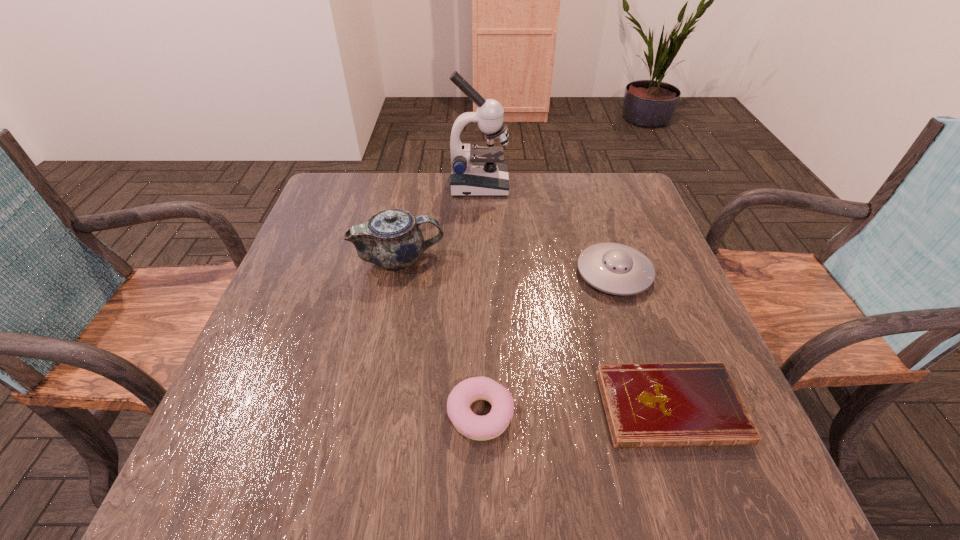
In the image, there is a desktop. Find the location of `free region at the left edge`. free region at the left edge is located at coordinates (315, 301).

Find the location of a particular element. vacant space at the right edge of the desktop is located at coordinates (656, 322).

You are a GUI agent. You are given a task and a screenshot of the screen. Output one action in this format:
    pyautogui.click(x=<x>, y=<y>)
    Task: Click on the free space at the far right corner of the desktop
    
    Given the screenshot: What is the action you would take?
    pyautogui.click(x=594, y=195)

Where is `vacant space that's between the shortest object and the chinaware`? This screenshot has width=960, height=540. vacant space that's between the shortest object and the chinaware is located at coordinates (535, 333).

Identify the location of free spot between the notebook and the second tallest object. The width and height of the screenshot is (960, 540). (535, 333).

You are a GUI agent. You are given a task and a screenshot of the screen. Output one action in this format:
    pyautogui.click(x=<x>, y=<y>)
    Task: Click on the vacant space in between the chinaware and the fourth tallest object
    The height and width of the screenshot is (540, 960).
    Given the screenshot: What is the action you would take?
    pyautogui.click(x=440, y=336)

Find the location of `free spot between the second tallest object and the saucer`. free spot between the second tallest object and the saucer is located at coordinates (507, 266).

Locate an element on the screen. The width and height of the screenshot is (960, 540). free spot between the shortest object and the saucer is located at coordinates (642, 340).

Locate an element on the screen. The image size is (960, 540). vacant area that lies between the shortest object and the tallest object is located at coordinates (575, 296).

You are a GUI agent. You are given a task and a screenshot of the screen. Output one action in this format:
    pyautogui.click(x=<x>, y=<y>)
    Task: Click on the vacant area that lies between the third shortest object and the doughnut
    
    Given the screenshot: What is the action you would take?
    pyautogui.click(x=547, y=344)